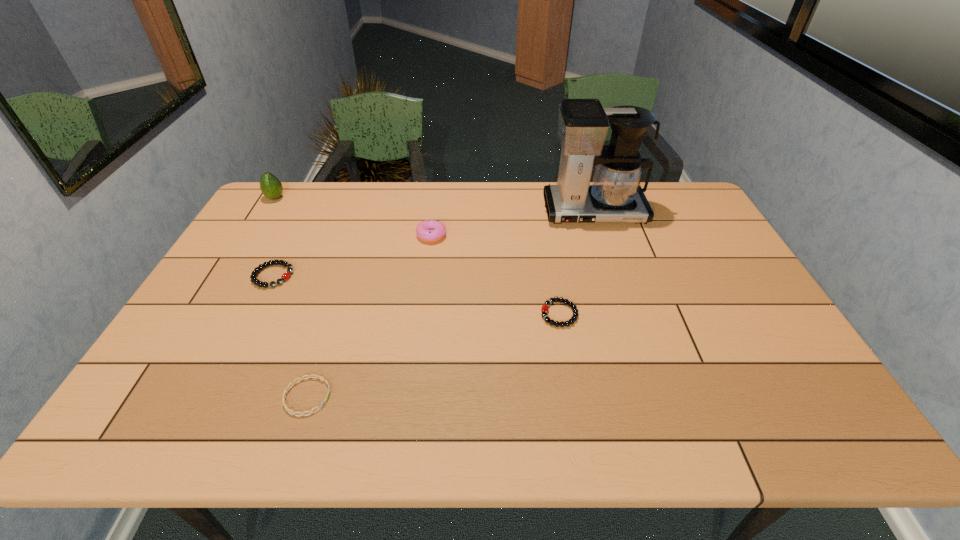
You are a GUI agent. You are given a task and a screenshot of the screen. Output one action in this format:
    pyautogui.click(x=<x>, y=<y>)
    Task: Click on the vacant area between the second farthest bracelet and the nearest object
    The width and height of the screenshot is (960, 540).
    Given the screenshot: What is the action you would take?
    pyautogui.click(x=433, y=355)

Identify the location of free space between the second bracelet from left to right and the second object from left to right. The height and width of the screenshot is (540, 960). (290, 336).

Where is `unoccupied position between the third object from right to left and the fifth shortest object`? This screenshot has width=960, height=540. unoccupied position between the third object from right to left and the fifth shortest object is located at coordinates (353, 217).

This screenshot has height=540, width=960. I want to click on free space between the avocado and the fourth shortest object, so click(x=353, y=217).

The height and width of the screenshot is (540, 960). Identify the location of vacant space that is in between the fourth farthest object and the avocado. (275, 237).

The width and height of the screenshot is (960, 540). Find the location of `free spot between the fourth object from right to left and the fourth object from left to right`. free spot between the fourth object from right to left and the fourth object from left to right is located at coordinates (370, 316).

You are a GUI agent. You are given a task and a screenshot of the screen. Output one action in this format:
    pyautogui.click(x=<x>, y=<y>)
    Task: Click on the vacant region between the shortest bracelet and the second object from left to right
    The height and width of the screenshot is (540, 960).
    Given the screenshot: What is the action you would take?
    pyautogui.click(x=290, y=336)

You are a GUI agent. You are given a task and a screenshot of the screen. Output one action in this format:
    pyautogui.click(x=<x>, y=<y>)
    Task: Click on the vacant space that's between the second farthest bracelet and the third object from left to right
    The height and width of the screenshot is (540, 960).
    Given the screenshot: What is the action you would take?
    pyautogui.click(x=433, y=355)

The height and width of the screenshot is (540, 960). In order to click on object that is the fourth closest to the leftmost object in this screenshot , I will do `click(615, 196)`.

Identify the location of the third closest object to the leftmost object. pos(309,376).